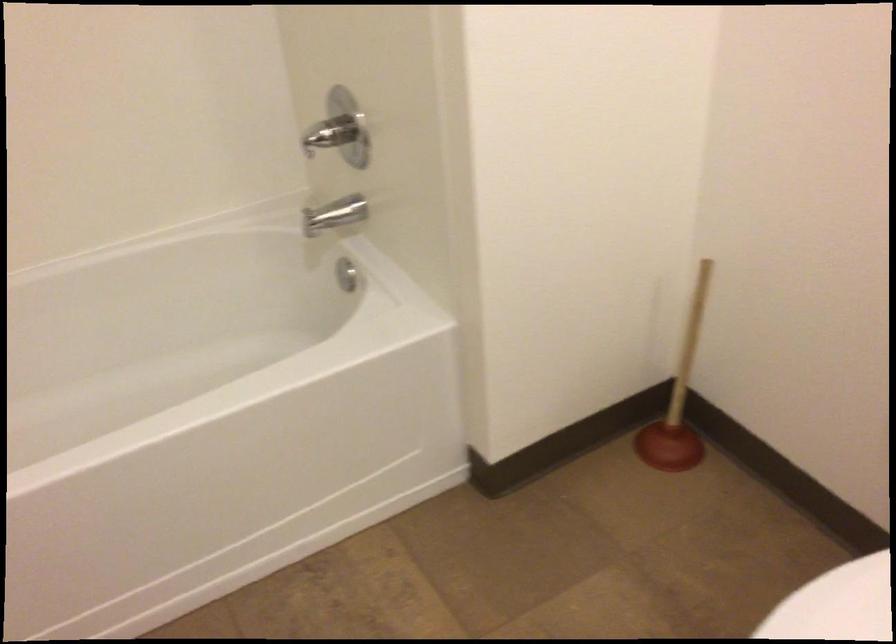
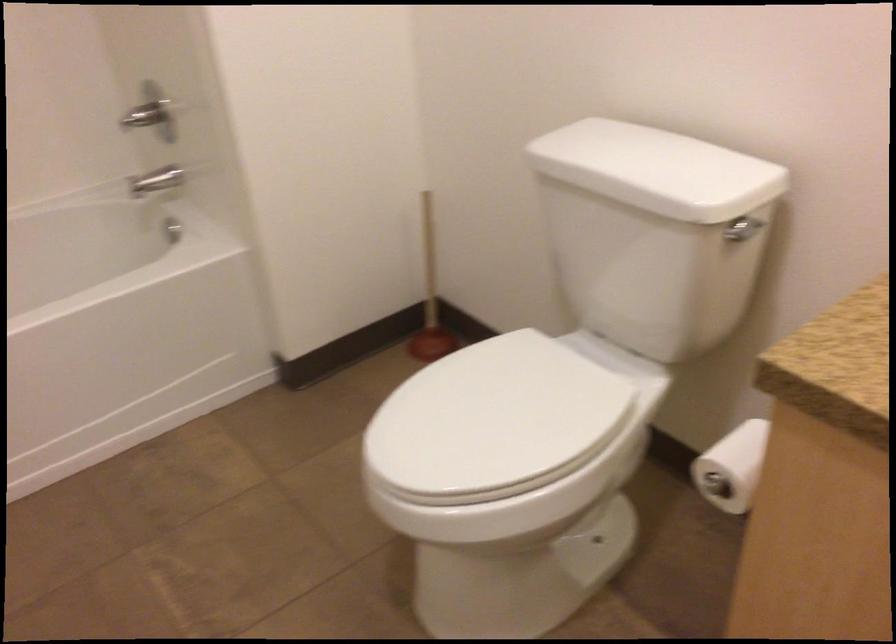
Question: The images are taken continuously from a first-person perspective. In which direction is your viewpoint rotating?

Choices:
 (A) Left
 (B) Right
 (C) Up
 (D) Down

Answer: (B)